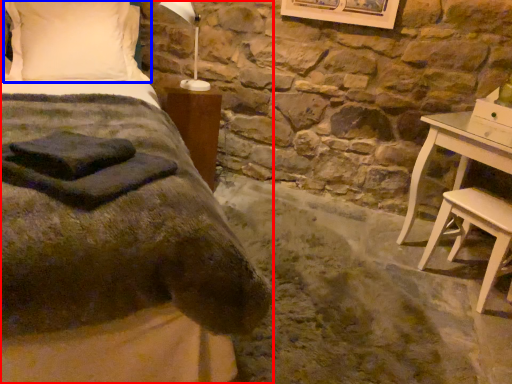
Question: Which object is closer to the camera taking this photo, bed (highlighted by a red box) or pillow (highlighted by a blue box)?

Choices:
 (A) bed
 (B) pillow

Answer: (A)